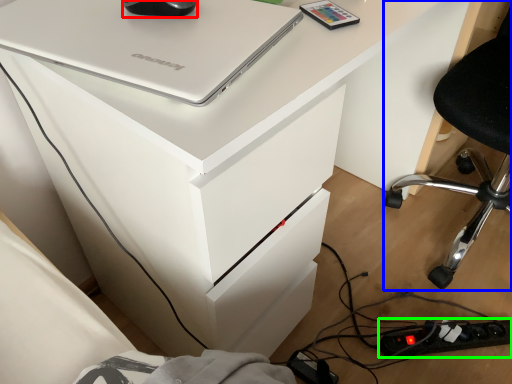
Question: Estimate the real-world distances between objects in this image. Which object is closer to mouse (highlighted by a red box), furniture (highlighted by a blue box) or extension cord (highlighted by a green box)?

Choices:
 (A) furniture
 (B) extension cord

Answer: (B)